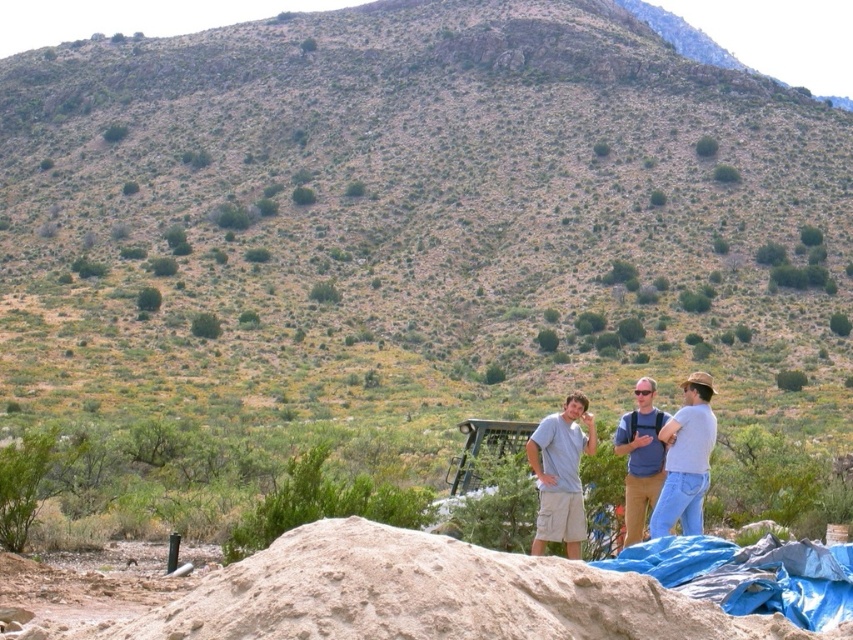
Is point (648, 400) behind point (660, 420)?

That is True.

Is point (630, 490) closer to viewer compared to point (654, 493)?

No, (630, 490) is behind (654, 493).

At what (x,y) coordinates should I click in order to perform the action: click on light blue cotton shirt at center. Please return your answer as a coordinate pair (x, y). This screenshot has width=853, height=640. Looking at the image, I should click on (643, 456).

Can you confirm if light blue cotton shirt at center is bigger than light blue jeans at center right?

Yes, light blue cotton shirt at center is bigger than light blue jeans at center right.

The image size is (853, 640). What do you see at coordinates (643, 456) in the screenshot?
I see `light blue cotton shirt at center` at bounding box center [643, 456].

Is point (659, 438) in front of point (682, 444)?

No.

Identify the location of light blue cotton shirt at center. (643, 456).

You are a GUI agent. You are given a task and a screenshot of the screen. Output one action in this format:
    pyautogui.click(x=<x>, y=<y>)
    Task: Click on the smooth sand mound at lower center
    The image size is (853, 640).
    Given the screenshot: What is the action you would take?
    pyautogui.click(x=430, y=595)

Does point (341, 611) come closer to viewer compared to point (650, 410)?

Yes, it is.

Locate an element on the screen. The width and height of the screenshot is (853, 640). smooth sand mound at lower center is located at coordinates (430, 595).